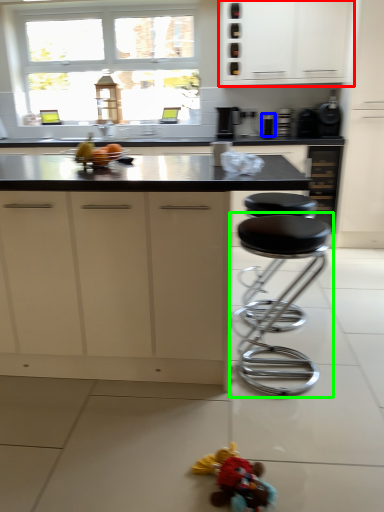
Question: Which object is positioned farthest from cabinetry (highlighted by a red box)? Select from appliance (highlighted by a blue box) and stool (highlighted by a green box).

Choices:
 (A) appliance
 (B) stool

Answer: (B)